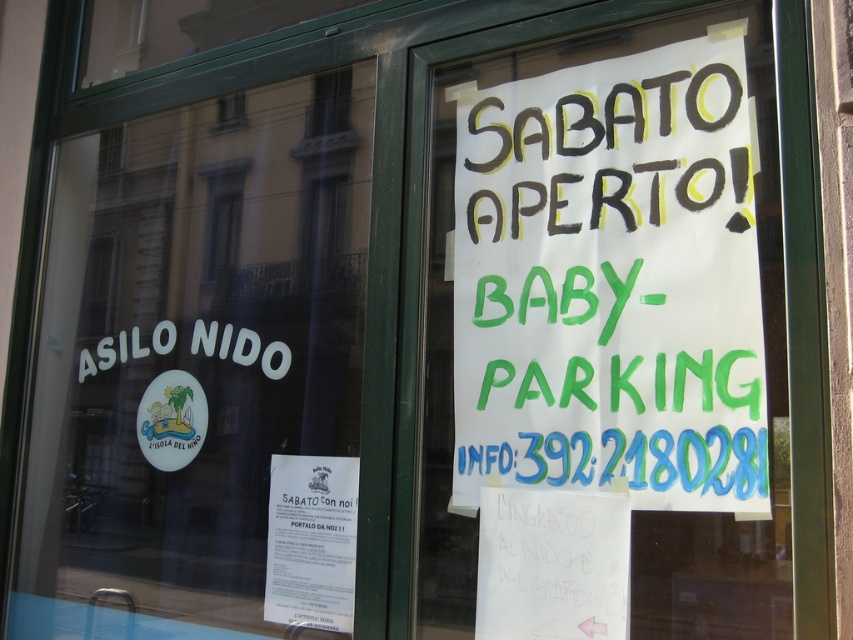
Between white paper sign at upper center and smooth glass window at upper center, which one appears on the right side from the viewer's perspective?

white paper sign at upper center is more to the right.

Does white paper sign at upper center come behind smooth glass window at upper center?

No, white paper sign at upper center is in front of smooth glass window at upper center.

What do you see at coordinates (633, 314) in the screenshot?
I see `white paper sign at upper center` at bounding box center [633, 314].

The image size is (853, 640). In order to click on white paper sign at upper center in this screenshot , I will do `click(633, 314)`.

Does white paper at upper left appear under smooth glass window at upper center?

Yes, white paper at upper left is below smooth glass window at upper center.

Between point (142, 294) and point (230, 246), which one is positioned behind?

The point (142, 294) is more distant.

This screenshot has height=640, width=853. Find the location of `white paper at upper left`. white paper at upper left is located at coordinates (206, 365).

Does white paper sign at upper center appear over white paper at upper left?

Yes, white paper sign at upper center is above white paper at upper left.

Is point (633, 374) positioned before point (335, 400)?

Yes, it is in front of point (335, 400).

Where is `white paper sign at upper center`? The height and width of the screenshot is (640, 853). white paper sign at upper center is located at coordinates (633, 314).

Locate an element on the screen. This screenshot has height=640, width=853. white paper sign at upper center is located at coordinates (633, 314).